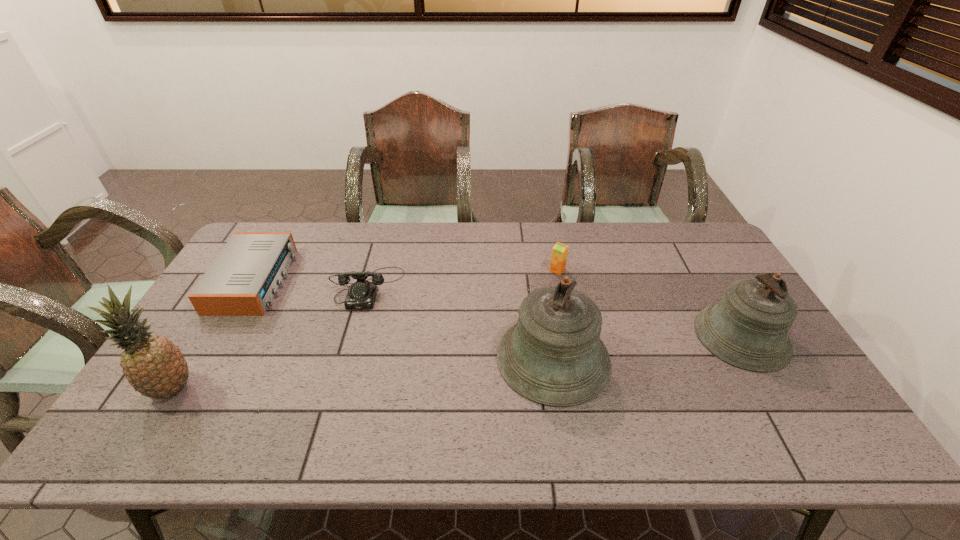
In the current image, all bells are evenly spaced. To maintain this equal spacing, where should an additional bell be placed on the left? Please point out a free spot. Please provide its 2D coordinates. Your answer should be formatted as a tuple, i.e. [(x, y)], where the tuple contains the x and y coordinates of a point satisfying the conditions above.

[(345, 382)]